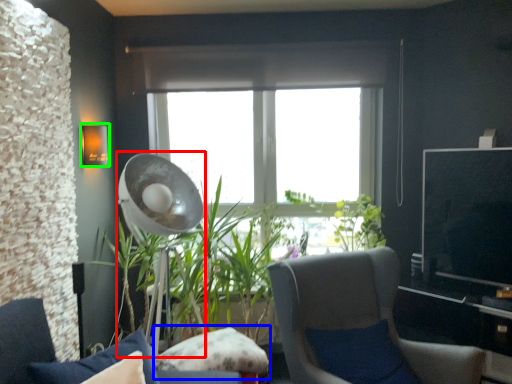
Question: Which is farther away from mechanical fan (highlighted by a red box)? pillow (highlighted by a blue box) or lamp (highlighted by a green box)?

Choices:
 (A) pillow
 (B) lamp

Answer: (A)